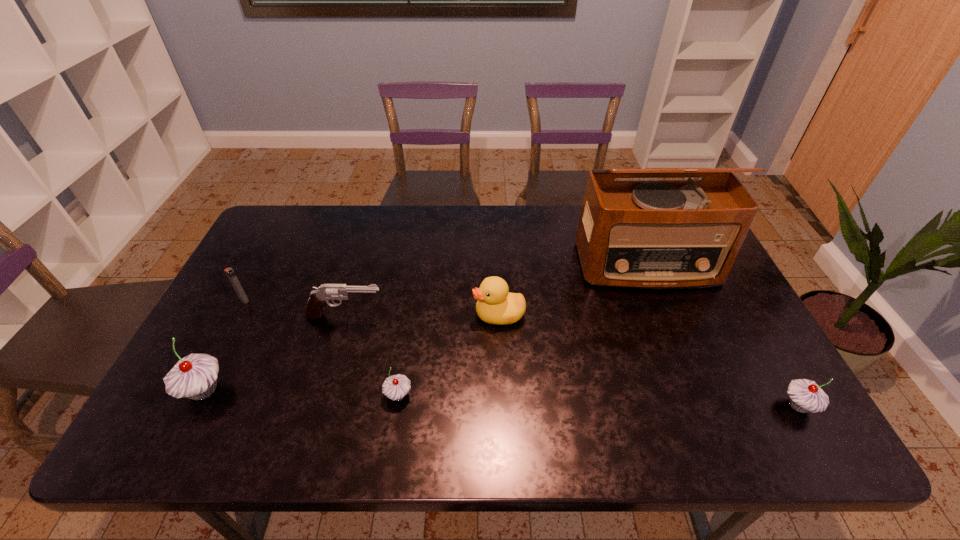
Where is `the tallest cupcake`? The width and height of the screenshot is (960, 540). the tallest cupcake is located at coordinates (195, 376).

Find the location of a particular element. The width and height of the screenshot is (960, 540). the second tallest object is located at coordinates (195, 376).

At what (x,y) coordinates should I click in order to perform the action: click on the shortest cupcake. Please return your answer as a coordinate pair (x, y). Image resolution: width=960 pixels, height=540 pixels. Looking at the image, I should click on (395, 387).

Where is `the shortest object`? The width and height of the screenshot is (960, 540). the shortest object is located at coordinates (395, 387).

Locate an element on the screen. the rightmost cupcake is located at coordinates (805, 395).

Locate an element on the screen. The image size is (960, 540). igniter is located at coordinates (230, 273).

Locate an element on the screen. Image resolution: width=960 pixels, height=540 pixels. the tallest object is located at coordinates (655, 234).

Locate an element on the screen. The height and width of the screenshot is (540, 960). the farthest object is located at coordinates (655, 234).

The image size is (960, 540). Identify the location of gun. (319, 297).

Locate an element on the screen. the fifth object from left to right is located at coordinates (496, 305).